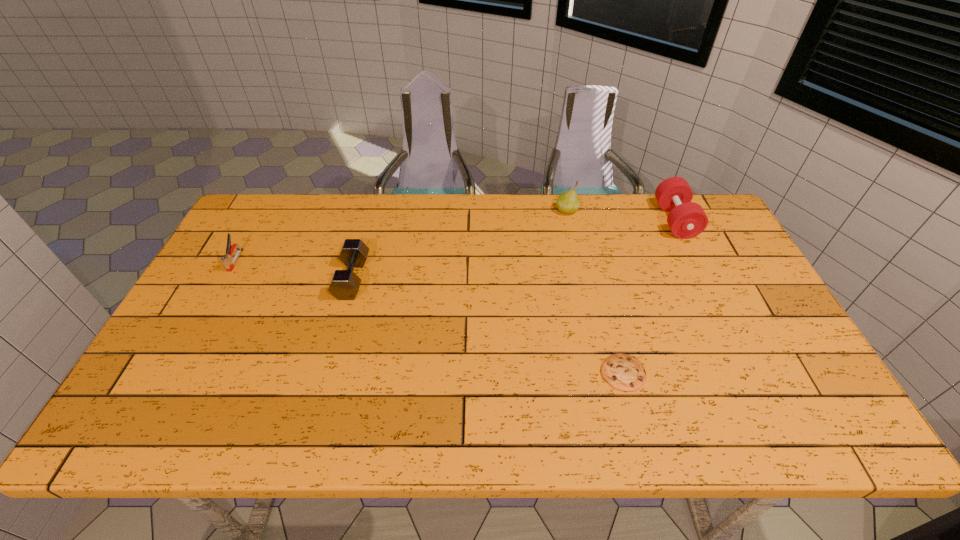
Locate an element on the screen. free space at the far left corner is located at coordinates (296, 197).

Locate an element on the screen. The height and width of the screenshot is (540, 960). vacant space at the near left corner of the desktop is located at coordinates (132, 423).

Where is `vacant area at the far right corner of the desktop`? vacant area at the far right corner of the desktop is located at coordinates (724, 238).

The width and height of the screenshot is (960, 540). In order to click on vacant space that is in between the pear and the leftmost object in this screenshot , I will do `click(401, 235)`.

Locate an element on the screen. The width and height of the screenshot is (960, 540). vacant region between the stapler and the taller dumbbell is located at coordinates (455, 240).

Where is `vacant space that's between the cookie and the stapler`? This screenshot has height=540, width=960. vacant space that's between the cookie and the stapler is located at coordinates tap(429, 316).

Locate an element on the screen. vacant area that lies between the shorter dumbbell and the shortest object is located at coordinates (488, 326).

Locate an element on the screen. This screenshot has width=960, height=540. free space between the stapler and the cookie is located at coordinates (429, 316).

Where is `empty space between the stapler and the cookie`? The width and height of the screenshot is (960, 540). empty space between the stapler and the cookie is located at coordinates (429, 316).

The width and height of the screenshot is (960, 540). I want to click on free space that is in between the pear and the right dumbbell, so click(621, 215).